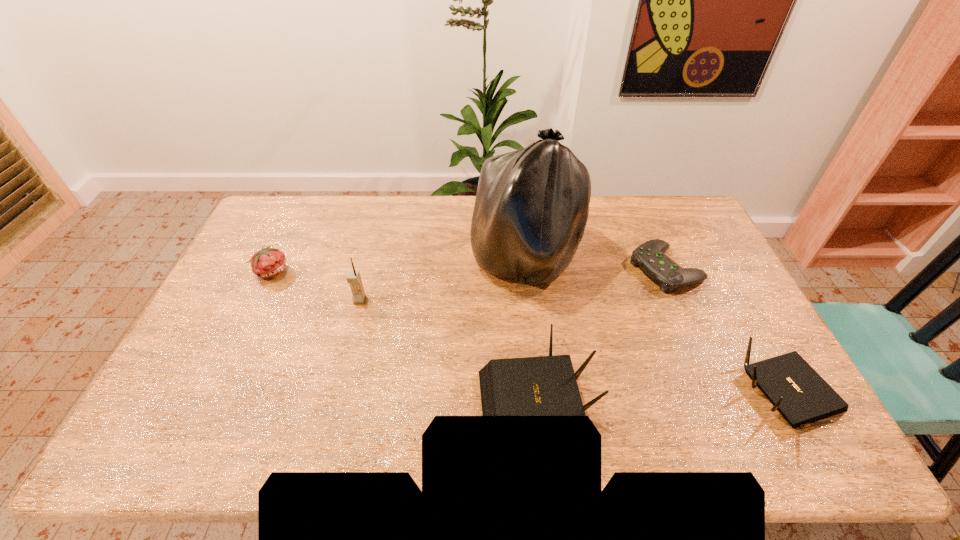
Considering the uniform spacing of routers, where should an additional router be positioned on the left? Please locate a free spot. Please provide its 2D coordinates. Your answer should be formatted as a tuple, i.e. [(x, y)], where the tuple contains the x and y coordinates of a point satisfying the conditions above.

[(278, 409)]